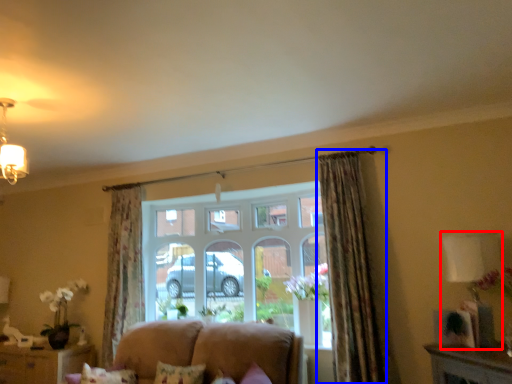
Question: Which point is further to the camera, lamp (highlighted by a red box) or curtain (highlighted by a blue box)?

Choices:
 (A) lamp
 (B) curtain

Answer: (B)